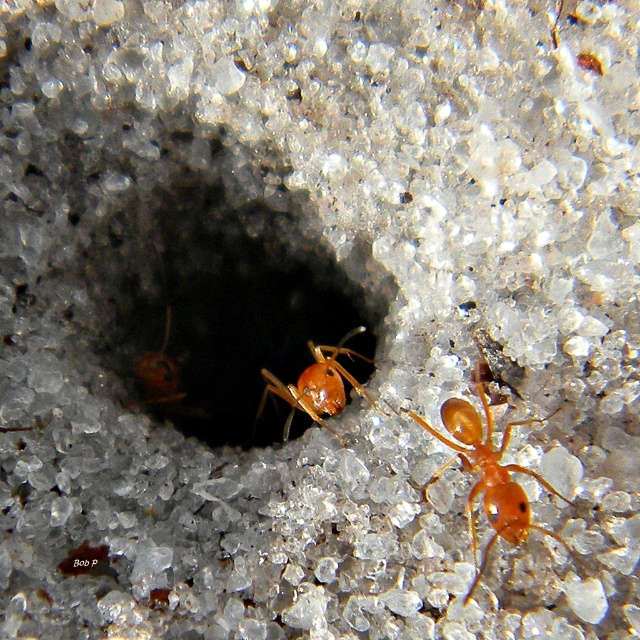
Between orange matte ant at center and orange glossy ant at center, which one is positioned higher?

orange glossy ant at center is above.

Which of these two, orange matte ant at center or orange glossy ant at center, stands taller?

With more height is orange matte ant at center.

Where is `orange matte ant at center`? Image resolution: width=640 pixels, height=640 pixels. orange matte ant at center is located at coordinates (486, 472).

You are a GUI agent. You are given a task and a screenshot of the screen. Output one action in this format:
    pyautogui.click(x=<x>, y=<y>)
    Task: Click on the orange matte ant at center
    The height and width of the screenshot is (640, 640).
    Given the screenshot: What is the action you would take?
    pyautogui.click(x=486, y=472)

Can you confirm if smooth sand hole at center is wider than orange glossy ant at center?

Correct, the width of smooth sand hole at center exceeds that of orange glossy ant at center.

Is smooth sand hole at center smaller than orange glossy ant at center?

No, smooth sand hole at center is not smaller than orange glossy ant at center.

What do you see at coordinates (221, 308) in the screenshot?
I see `smooth sand hole at center` at bounding box center [221, 308].

Identify the location of smooth sand hole at center. This screenshot has width=640, height=640. (221, 308).

Between orange matte ant at center and shiny orange ant at center, which one has less height?

shiny orange ant at center

Consider the image. Can you confirm if orange matte ant at center is positioned to the right of shiny orange ant at center?

Yes, orange matte ant at center is to the right of shiny orange ant at center.

The width and height of the screenshot is (640, 640). Describe the element at coordinates (486, 472) in the screenshot. I see `orange matte ant at center` at that location.

Locate an element on the screen. orange matte ant at center is located at coordinates (486, 472).